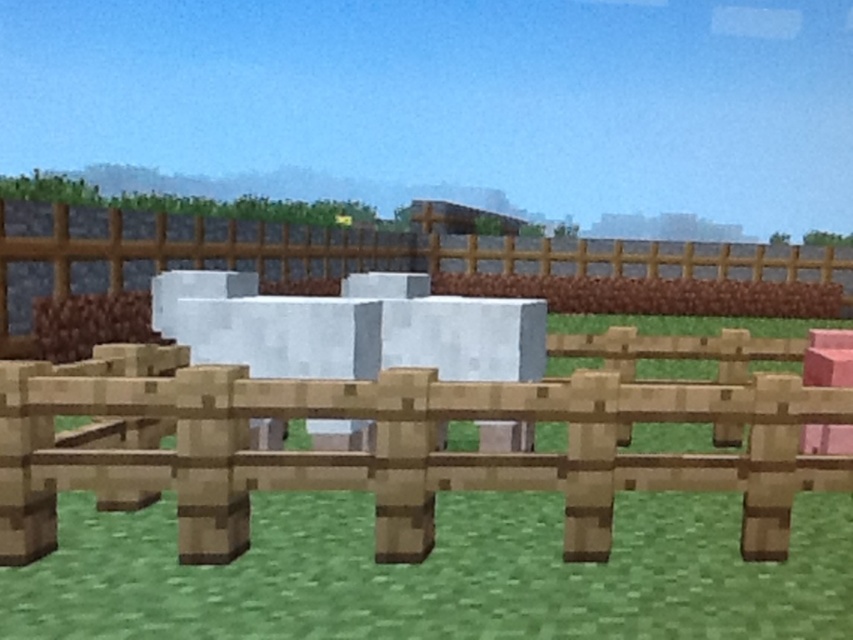
Which is more to the left, green grass at center or wooden fence at center?

From the viewer's perspective, green grass at center appears more on the left side.

Between green grass at center and wooden fence at center, which one is positioned higher?

wooden fence at center is above.

Where is `green grass at center`? This screenshot has height=640, width=853. green grass at center is located at coordinates (439, 573).